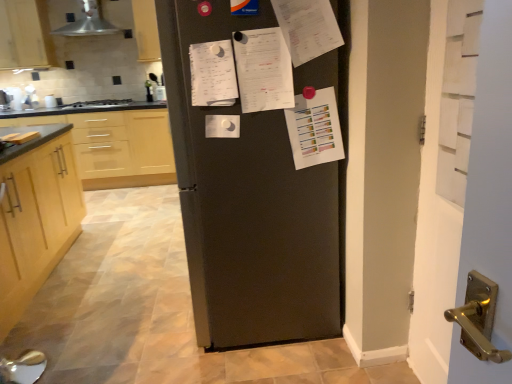
Locate an element on the screen. Image resolution: width=512 pixels, height=384 pixels. vacant space that is in between light wood cabinet at left, arranged as the 3th cabinetry when viewed from the top, and matte black fridge at center is located at coordinates (113, 287).